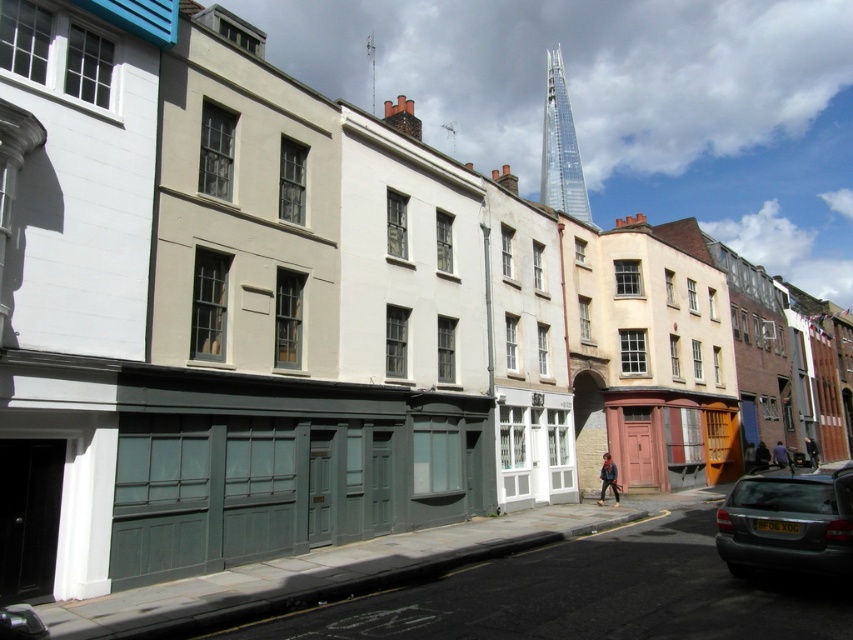
Who is higher up, matte gray car at lower right or transparent glass spire at upper center?

transparent glass spire at upper center is higher up.

Between point (845, 544) and point (573, 147), which one is positioned behind?

The point (573, 147) is behind.

Does point (813, 516) come closer to viewer compared to point (546, 147)?

Yes, point (813, 516) is in front of point (546, 147).

The height and width of the screenshot is (640, 853). In order to click on matte gray car at lower right in this screenshot , I will do `click(787, 524)`.